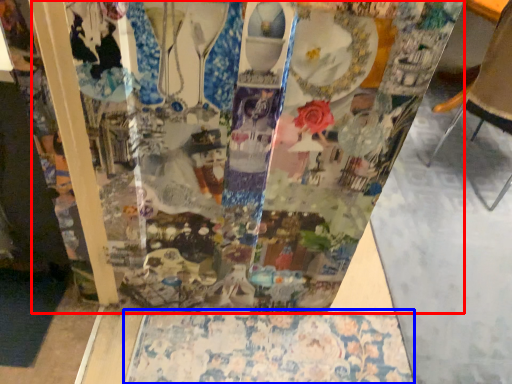
Question: Which object is further to the camera taking this photo, glass box (highlighted by a red box) or tablecloth (highlighted by a blue box)?

Choices:
 (A) glass box
 (B) tablecloth

Answer: (B)